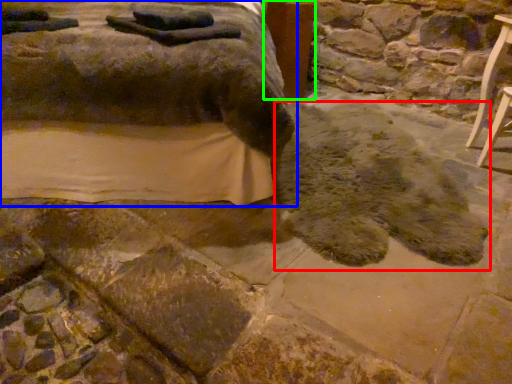
Question: Based on their relative distances, which object is nearer to footprint (highlighted by a red box)? Choose from furniture (highlighted by a blue box) and table (highlighted by a green box).

Choices:
 (A) furniture
 (B) table

Answer: (A)